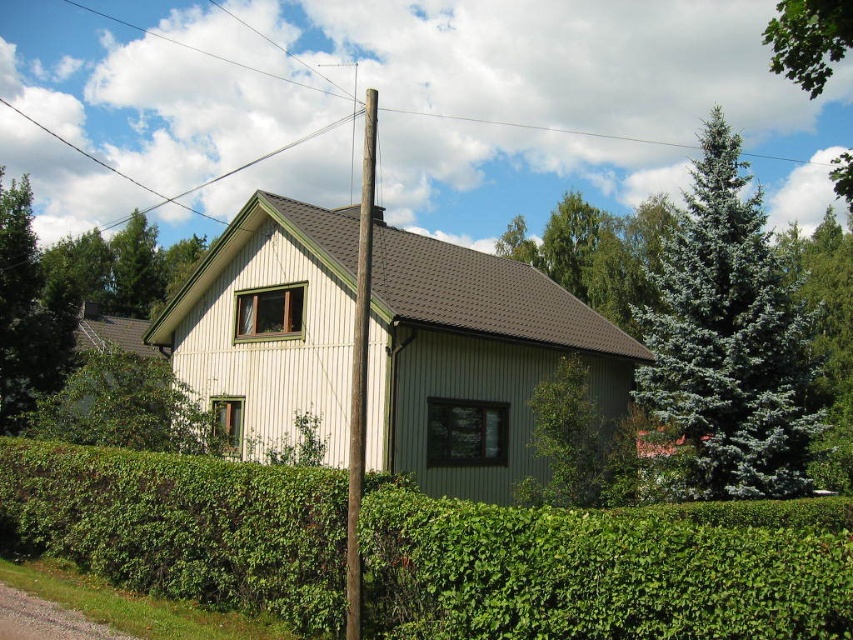
The width and height of the screenshot is (853, 640). Describe the element at coordinates (68, 292) in the screenshot. I see `green leafy tree at upper left` at that location.

Who is taller, green leafy tree at upper left or green leafy bush at lower left?

With more height is green leafy tree at upper left.

Is point (134, 260) closer to camera compared to point (199, 417)?

No.

At what (x,y) coordinates should I click in order to perform the action: click on green leafy tree at upper left. Please return your answer as a coordinate pair (x, y). This screenshot has height=640, width=853. Looking at the image, I should click on (68, 292).

Is the position of green leafy tree at upper left less distant than that of green textured tree at upper left?

Yes, green leafy tree at upper left is in front of green textured tree at upper left.

Is green leafy tree at upper left above green textured tree at upper left?

Incorrect, green leafy tree at upper left is not positioned above green textured tree at upper left.

Image resolution: width=853 pixels, height=640 pixels. What are the coordinates of `green leafy tree at upper left` in the screenshot? It's located at (68, 292).

Locate an element on the screen. green leafy tree at upper left is located at coordinates (68, 292).

Does green leafy bush at lower left have a smaller size compared to green leafy tree at upper right?

Indeed, green leafy bush at lower left has a smaller size compared to green leafy tree at upper right.

Who is more distant from viewer, (x=149, y=406) or (x=770, y=20)?

The point (x=770, y=20) is behind.

Who is more forward, (109, 380) or (793, 52)?

Point (793, 52) is in front.

You are a GUI agent. You are given a task and a screenshot of the screen. Output one action in this format:
    pyautogui.click(x=<x>, y=<y>)
    Task: Click on the green leafy bush at lower left
    The width and height of the screenshot is (853, 640).
    Given the screenshot: What is the action you would take?
    pyautogui.click(x=125, y=406)